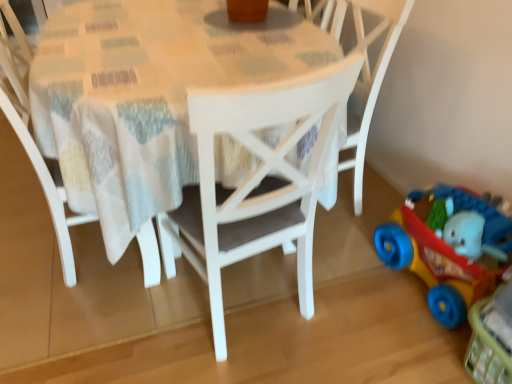
Question: Can we say white matte chair at center, arranged as the first chair when viewed from the left, lies outside rubberized plastic toy car at lower right?

Choices:
 (A) no
 (B) yes

Answer: (B)

Question: Can you confirm if white matte chair at center, which ranks as the second chair in right-to-left order, is shorter than rubberized plastic toy car at lower right?

Choices:
 (A) yes
 (B) no

Answer: (B)

Question: Could you tell me if white matte chair at center, which ranks as the second chair in right-to-left order, is facing rubberized plastic toy car at lower right?

Choices:
 (A) no
 (B) yes

Answer: (A)

Question: Does white matte chair at center, which ranks as the second chair in right-to-left order, have a greater height compared to rubberized plastic toy car at lower right?

Choices:
 (A) yes
 (B) no

Answer: (A)

Question: From a real-world perspective, does white matte chair at center, which ranks as the second chair in right-to-left order, stand above rubberized plastic toy car at lower right?

Choices:
 (A) no
 (B) yes

Answer: (B)

Question: From a real-world perspective, is white painted wood table at center positioned above or below white matte chair at center, arranged as the first chair when viewed from the left?

Choices:
 (A) below
 (B) above

Answer: (A)

Question: Based on their positions, is white painted wood table at center located to the left or right of white matte chair at center, which ranks as the second chair in right-to-left order?

Choices:
 (A) left
 (B) right

Answer: (B)

Question: Relative to white matte chair at center, which ranks as the second chair in right-to-left order, is white painted wood table at center in front or behind?

Choices:
 (A) front
 (B) behind

Answer: (A)

Question: In terms of height, does white painted wood table at center look taller or shorter compared to white matte chair at center, arranged as the first chair when viewed from the left?

Choices:
 (A) tall
 (B) short

Answer: (B)

Question: Based on their positions, is white matte chair at center, positioned as the 2th chair in left-to-right order, located to the left or right of white painted wood table at center?

Choices:
 (A) left
 (B) right

Answer: (B)

Question: In terms of width, does white matte chair at center, which is the 1th chair from right to left, look wider or thinner when compared to white painted wood table at center?

Choices:
 (A) thin
 (B) wide

Answer: (A)

Question: From the image's perspective, is white matte chair at center, positioned as the 2th chair in left-to-right order, above or below white painted wood table at center?

Choices:
 (A) above
 (B) below

Answer: (A)

Question: Relative to white painted wood table at center, is white matte chair at center, positioned as the 2th chair in left-to-right order, in front or behind?

Choices:
 (A) front
 (B) behind

Answer: (B)

Question: In the image, is white matte chair at center, positioned as the 2th chair in left-to-right order, positioned in front of or behind white matte chair at center, arranged as the first chair when viewed from the left?

Choices:
 (A) front
 (B) behind

Answer: (B)

Question: Is white matte chair at center, positioned as the 2th chair in left-to-right order, bigger or smaller than white matte chair at center, which ranks as the second chair in right-to-left order?

Choices:
 (A) big
 (B) small

Answer: (B)